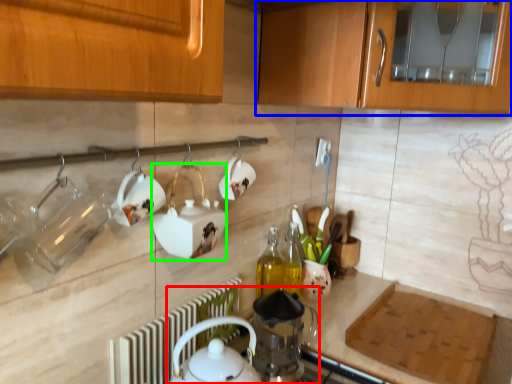
Question: Which is farther away from tea set (highlighted by a red box)? cabinetry (highlighted by a blue box) or appliance (highlighted by a green box)?

Choices:
 (A) cabinetry
 (B) appliance

Answer: (A)